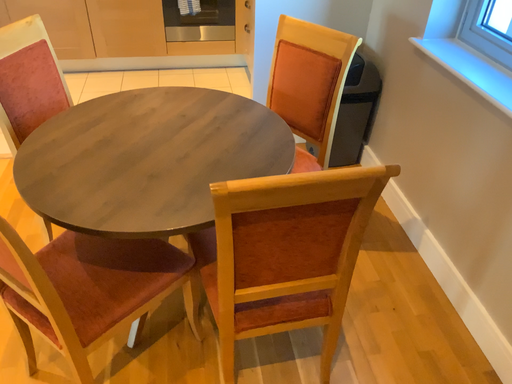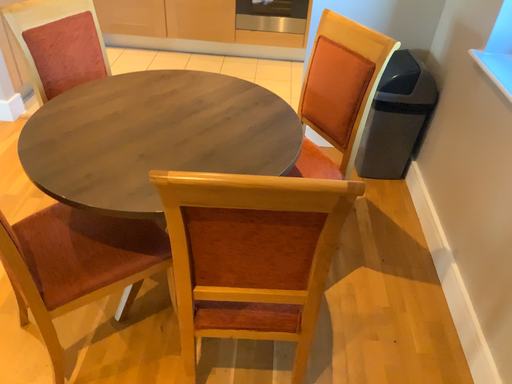
Question: Which way did the camera rotate in the video?

Choices:
 (A) rotated right
 (B) rotated left

Answer: (B)